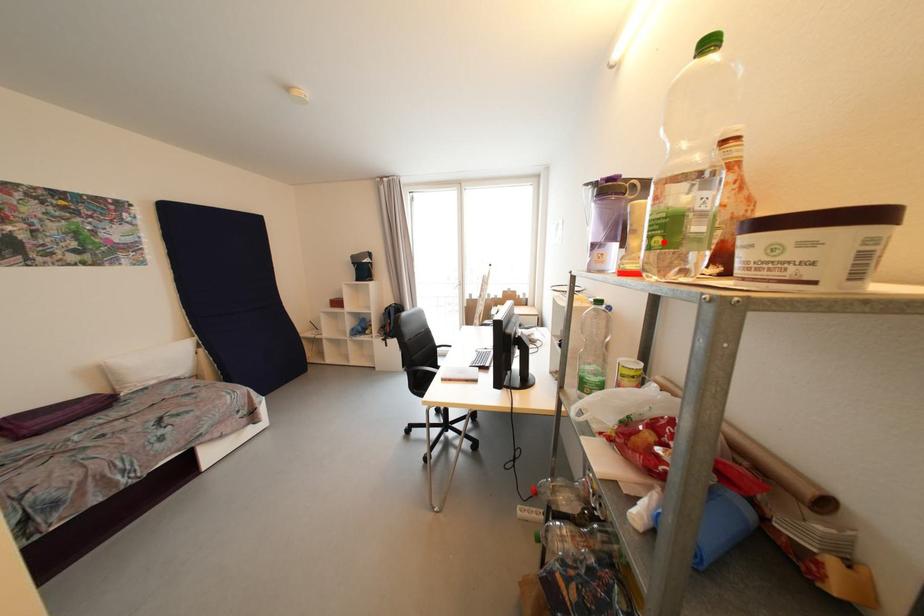
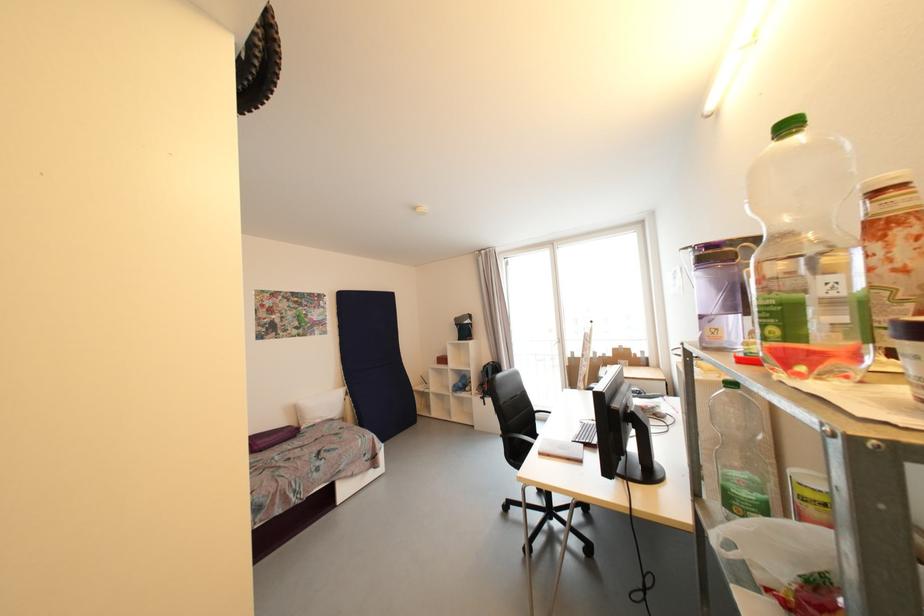
In the second image, find the point that corresponds to the highlighted location in the first image.

(780, 331)